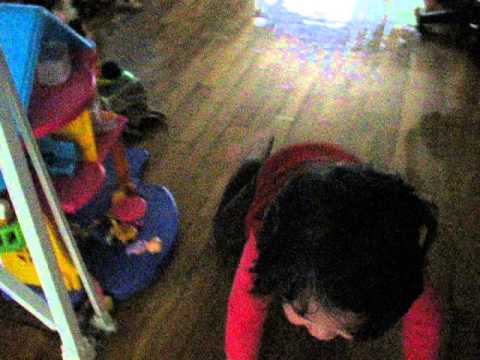
This screenshot has height=360, width=480. In order to click on wood floor in this screenshot , I will do `click(204, 111)`, `click(224, 115)`, `click(407, 116)`.